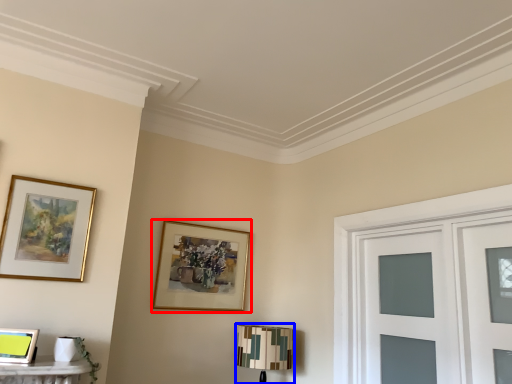
Question: Which object is closer to the camera taking this photo, picture frame (highlighted by a red box) or table lamp (highlighted by a blue box)?

Choices:
 (A) picture frame
 (B) table lamp

Answer: (B)